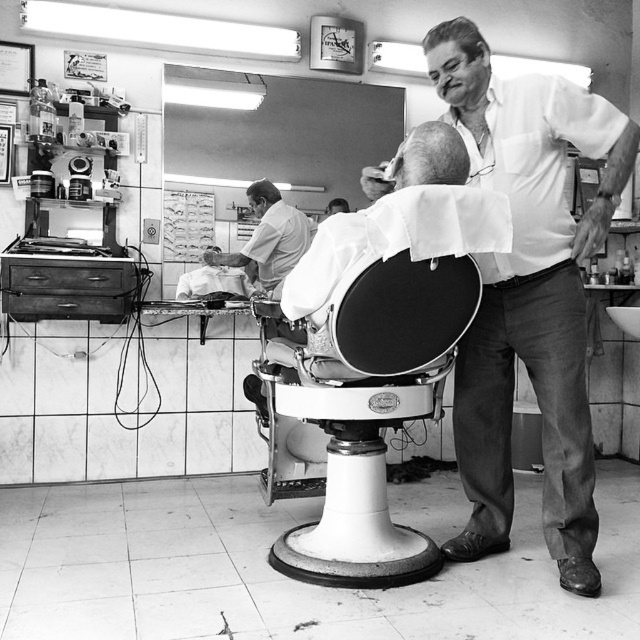
Question: Can you confirm if gray matte hair at upper center is positioned to the left of short dark hair at center?

Choices:
 (A) no
 (B) yes

Answer: (A)

Question: Does smooth skin man at center have a greater width compared to short dark hair at center?

Choices:
 (A) no
 (B) yes

Answer: (B)

Question: Which point is closer to the camera taking this photo?

Choices:
 (A) (346, 208)
 (B) (262, 179)
 (C) (433, 131)
 (D) (225, 262)

Answer: (C)

Question: Is smooth skin man at center above dark brown hair at upper center?

Choices:
 (A) no
 (B) yes

Answer: (A)

Question: Among these objects, which one is farthest from the camera?

Choices:
 (A) gray matte hair at center
 (B) gray matte hair at upper center
 (C) white cotton shirt at upper right

Answer: (B)

Question: Estimate the real-world distances between objects in this image. Which object is closer to the short dark hair at center?

Choices:
 (A) smooth skin man at center
 (B) dark brown hair at upper center
 (C) gray matte hair at center

Answer: (B)